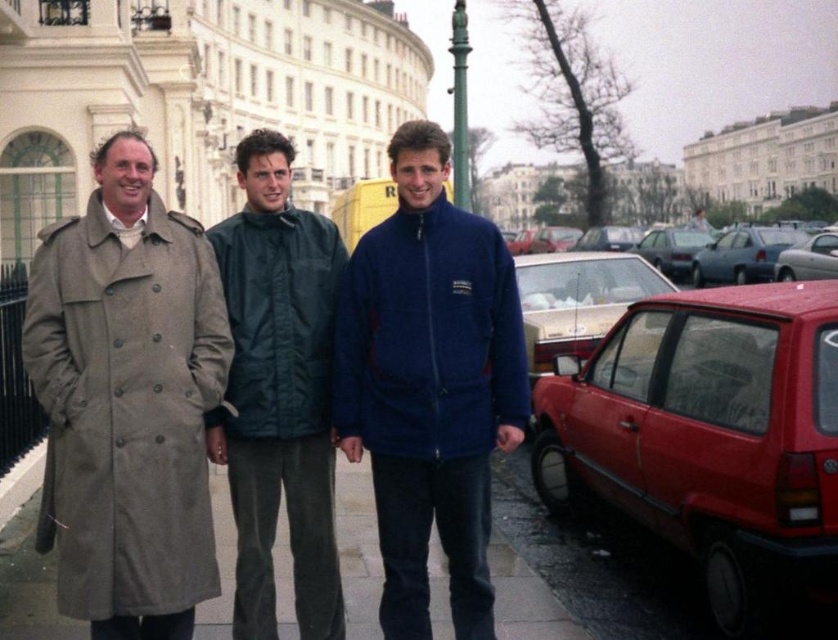
Question: Is shiny red hatchback at right behind light brown fabric trench coat at left?

Choices:
 (A) yes
 (B) no

Answer: (B)

Question: Among these objects, which one is farthest from the camera?

Choices:
 (A) shiny red hatchback at right
 (B) metallic silver sedan at center right
 (C) green fabric jacket at center

Answer: (B)

Question: Among these points, which one is nearest to the camera?

Choices:
 (A) (91, 419)
 (B) (805, 291)
 (C) (213, 413)

Answer: (A)

Question: Can you confirm if light brown fabric trench coat at left is wider than green fabric jacket at center?

Choices:
 (A) yes
 (B) no

Answer: (A)

Question: Is light brown fabric trench coat at left to the left of gray concrete pavement at lower center from the viewer's perspective?

Choices:
 (A) yes
 (B) no

Answer: (A)

Question: Which point appears farthest from the camera in this image?

Choices:
 (A) (732, 269)
 (B) (385, 241)
 (C) (53, 369)
 (D) (211, 618)

Answer: (A)